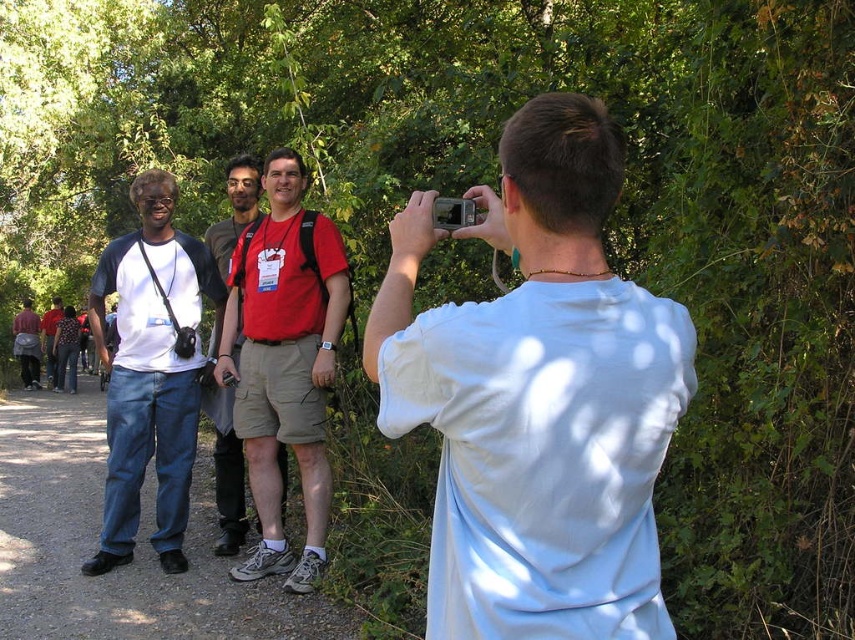
Question: Which point appears farthest from the camera in this image?

Choices:
 (A) (488, 608)
 (B) (175, 266)
 (C) (333, 346)

Answer: (B)

Question: Considering the real-world distances, which object is farthest from the red fabric shirt at center?

Choices:
 (A) white matte shirt at upper right
 (B) blue jeans at left

Answer: (A)

Question: Can you confirm if white matte shirt at upper right is wider than denim jeans at left?

Choices:
 (A) no
 (B) yes

Answer: (A)

Question: From the image, what is the correct spatial relationship of blue jeans at left in relation to denim jeans at left?

Choices:
 (A) right
 (B) left

Answer: (B)

Question: Is white matte shirt at upper right bigger than red fabric shirt at center?

Choices:
 (A) no
 (B) yes

Answer: (A)

Question: Which of the following is the farthest from the observer?

Choices:
 (A) blue jeans at left
 (B) red cotton t-shirt at center
 (C) denim jeans at left
 (D) red fabric shirt at center

Answer: (D)